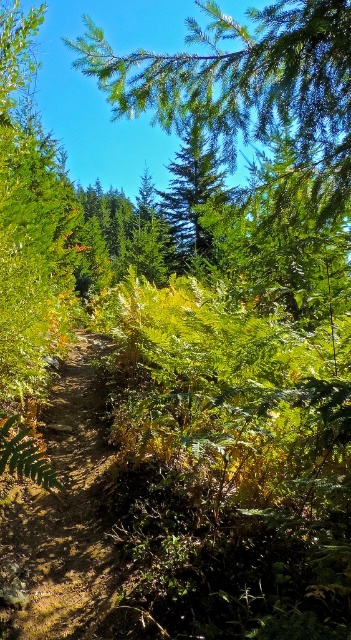
You are standing on the forest trail and want to reach a point that is exactly 10 feet away from your current position. Is the point at point (0, 518) within that distance?

The point at point (0, 518) is 12.50 feet away from the viewer, which is beyond the 10 feet distance you want to reach. So it is not within that distance.